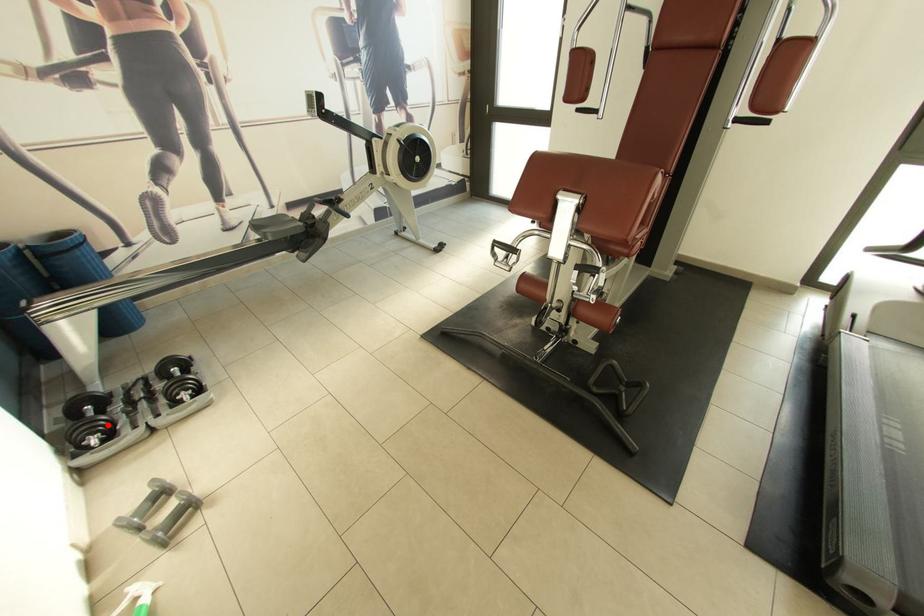
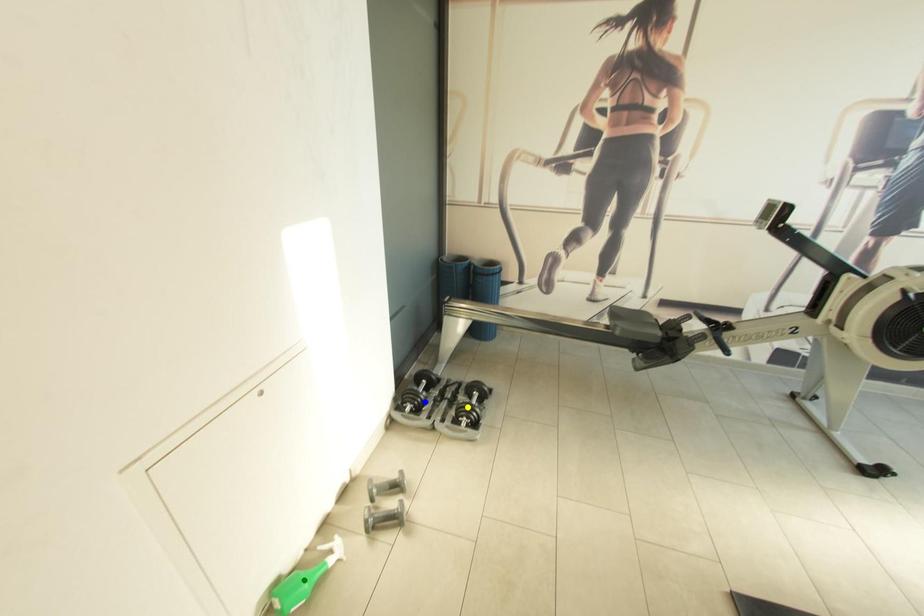
Question: I am providing you with two images of the same scene from different viewpoints. A red point is marked on the first image. You are given multiple points on the second image. Which point in image 2 represents the same 3d spot as the red point in image 1?

Choices:
 (A) yellow point
 (B) green point
 (C) blue point

Answer: (C)